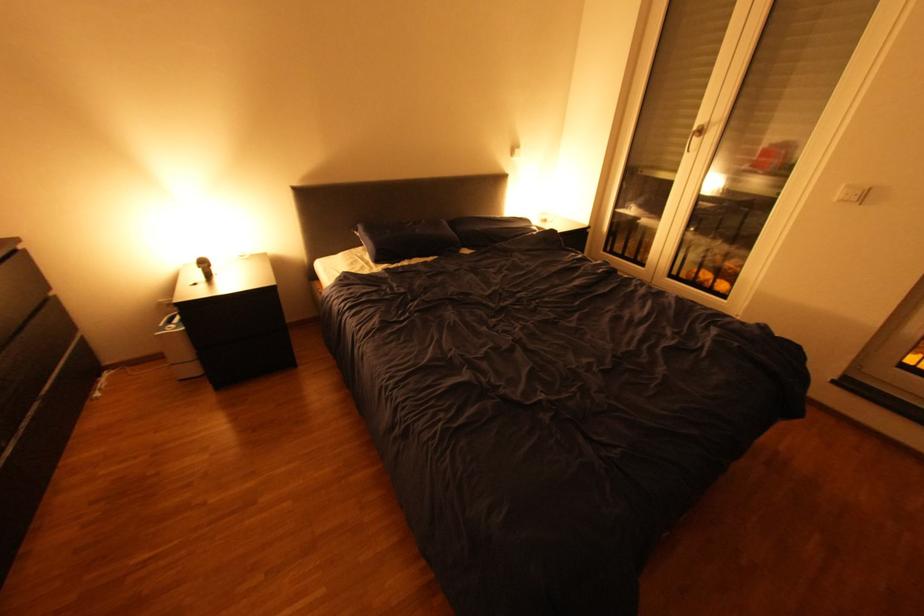
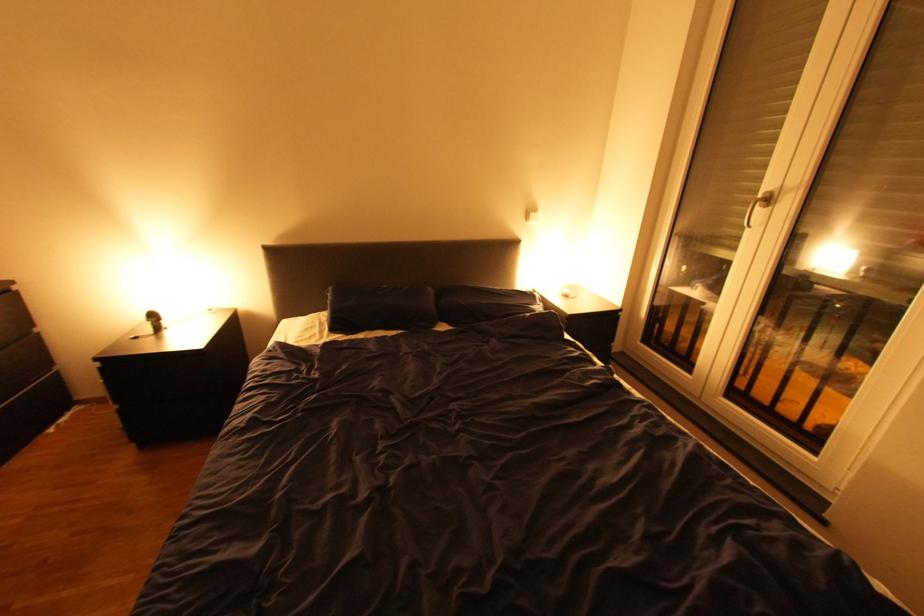
Find the pixel in the second image that matches (x=700, y=126) in the first image.

(767, 192)